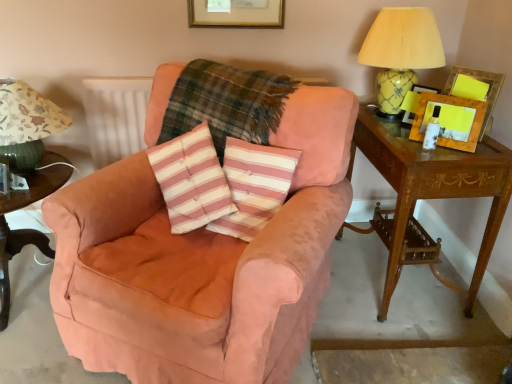
Question: Can you see dark green wood side table at lower left touching green fabric lampshade at left, the second table lamp from the right?

Choices:
 (A) no
 (B) yes

Answer: (A)

Question: Could you tell me if dark green wood side table at lower left is turned towards green fabric lampshade at left, the second table lamp from the right?

Choices:
 (A) yes
 (B) no

Answer: (B)

Question: Is dark green wood side table at lower left in front of green fabric lampshade at left, the 1th table lamp from the left?

Choices:
 (A) yes
 (B) no

Answer: (A)

Question: Considering the relative sizes of dark green wood side table at lower left and green fabric lampshade at left, the 1th table lamp from the left, in the image provided, is dark green wood side table at lower left thinner than green fabric lampshade at left, the 1th table lamp from the left,?

Choices:
 (A) yes
 (B) no

Answer: (B)

Question: Is green fabric lampshade at left, the 1th table lamp from the left, surrounded by dark green wood side table at lower left?

Choices:
 (A) yes
 (B) no

Answer: (B)

Question: Is dark green wood side table at lower left wider than green fabric lampshade at left, the 1th table lamp from the left?

Choices:
 (A) no
 (B) yes

Answer: (B)

Question: Are suede pink armchair at center and white textured radiator at upper left far apart?

Choices:
 (A) yes
 (B) no

Answer: (B)

Question: Is suede pink armchair at center turned away from white textured radiator at upper left?

Choices:
 (A) no
 (B) yes

Answer: (A)

Question: Considering the relative positions of suede pink armchair at center and white textured radiator at upper left in the image provided, is suede pink armchair at center to the right of white textured radiator at upper left from the viewer's perspective?

Choices:
 (A) no
 (B) yes

Answer: (B)

Question: Would you say suede pink armchair at center is outside white textured radiator at upper left?

Choices:
 (A) yes
 (B) no

Answer: (A)

Question: Is suede pink armchair at center further to camera compared to white textured radiator at upper left?

Choices:
 (A) yes
 (B) no

Answer: (B)

Question: Is suede pink armchair at center taller than white textured radiator at upper left?

Choices:
 (A) no
 (B) yes

Answer: (B)

Question: Would you say plaid fabric at center contains wooden picture frame at upper right, the 1th picture frame positioned from the right?

Choices:
 (A) yes
 (B) no

Answer: (B)